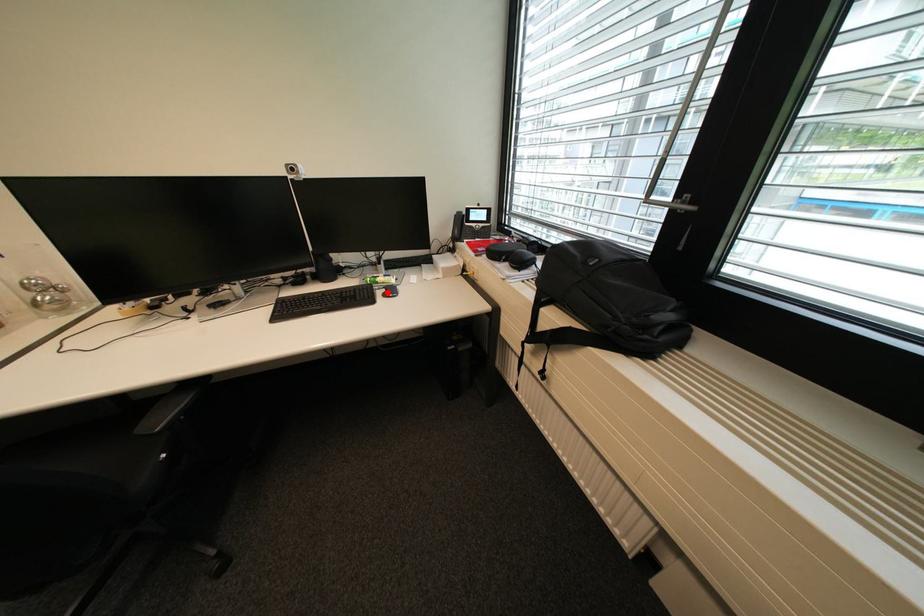
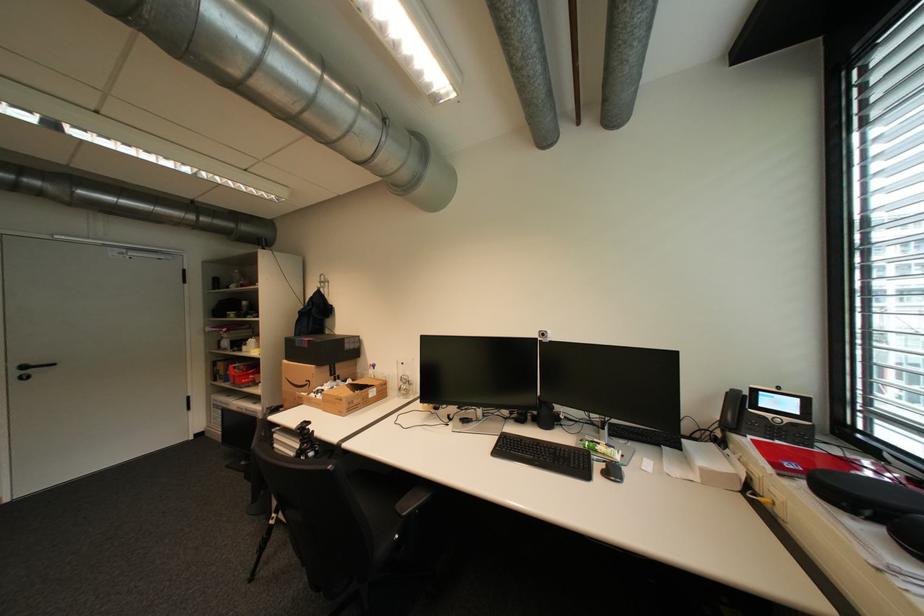
The point at the highlighted location is marked in the first image. Where is the corresponding point in the second image?

(606, 467)